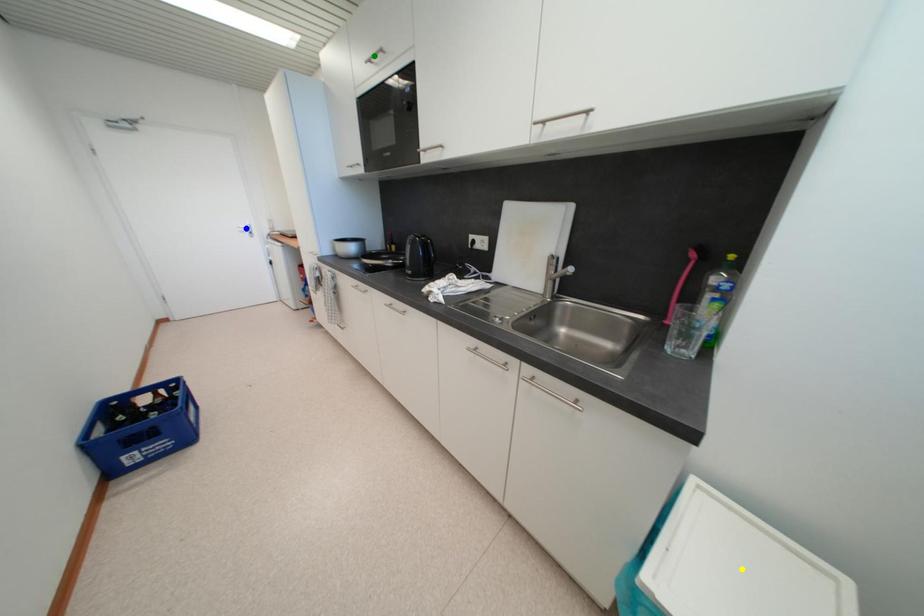
Order these from nearest to farthest:
A) yellow point
B) green point
C) blue point

blue point
green point
yellow point